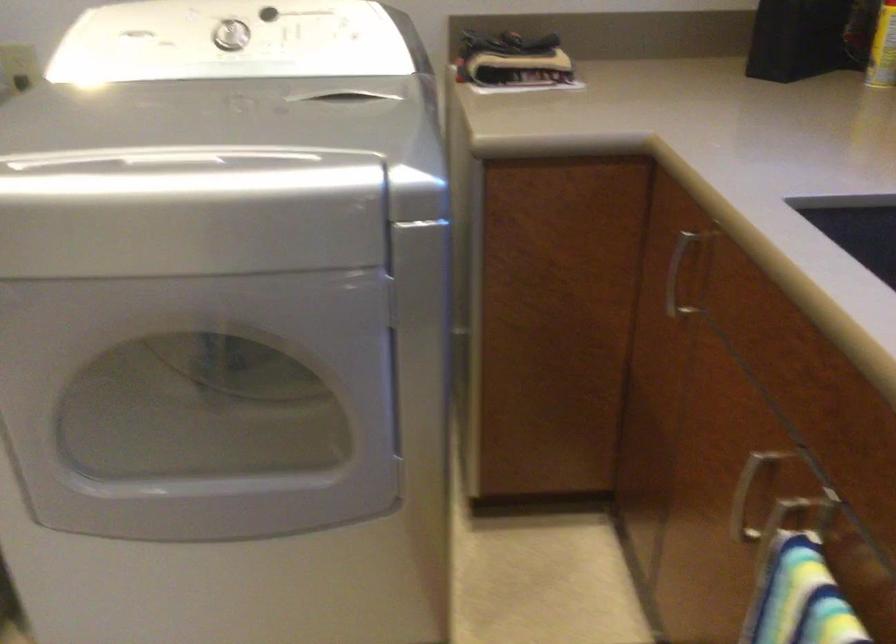
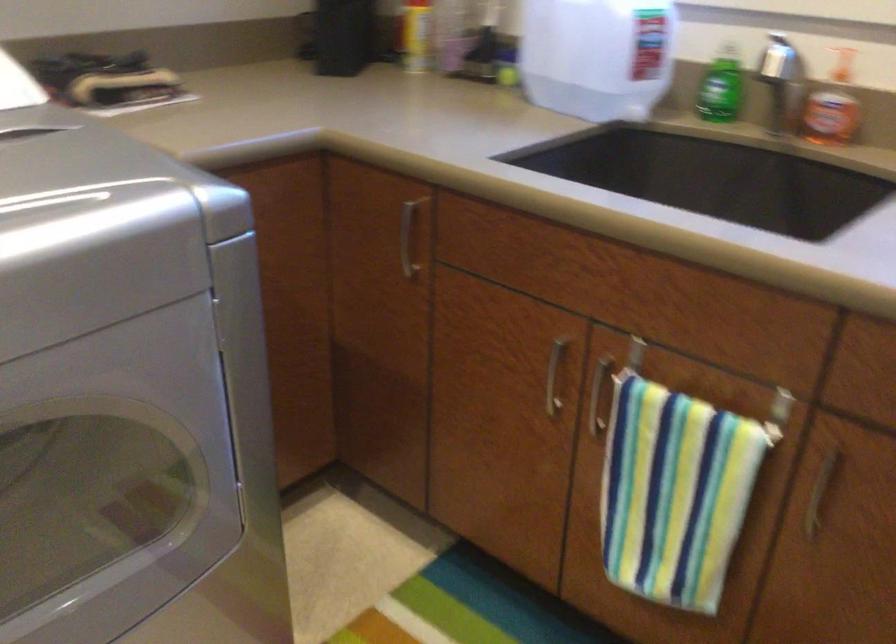
The point at (688, 272) is marked in the first image. Where is the corresponding point in the second image?

(407, 238)